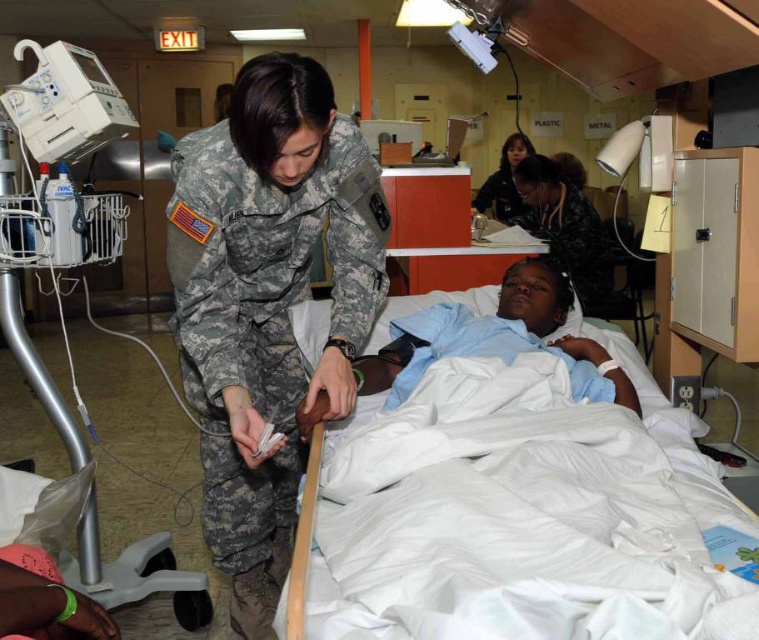
Does camouflage fabric uniform at center have a smaller size compared to dark brown leather jacket at upper center?

Yes, camouflage fabric uniform at center is smaller than dark brown leather jacket at upper center.

Consider the image. Between camouflage fabric uniform at center and dark brown leather jacket at upper center, which one appears on the right side from the viewer's perspective?

Positioned to the right is dark brown leather jacket at upper center.

Between point (260, 339) and point (531, 147), which one is positioned in front?

Point (260, 339) is in front.

Identify the location of camouflage fabric uniform at center. (266, 266).

Is point (156, 534) closer to camera compared to point (597, 216)?

Yes, point (156, 534) is in front of point (597, 216).

Between point (61, 426) and point (534, 227), which one is positioned behind?

Positioned behind is point (534, 227).

Identify the location of white plastic medical cart at left. (137, 573).

Who is taller, white plastic medical cart at left or dark brown leather jacket at upper center?

white plastic medical cart at left is taller.

Is point (5, 269) less distant than point (515, 218)?

Yes, it is in front of point (515, 218).

Where is `white plastic medical cart at left`? white plastic medical cart at left is located at coordinates (137, 573).